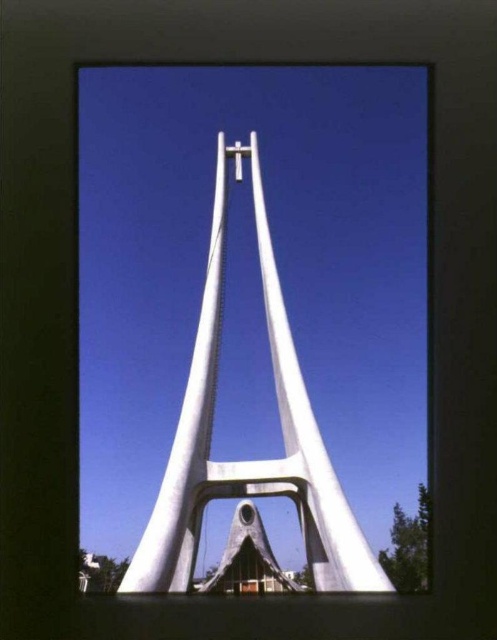
Question: Is white smooth monument at center to the left of white matte cross at center from the viewer's perspective?

Choices:
 (A) no
 (B) yes

Answer: (A)

Question: Does white smooth monument at center have a lesser width compared to white matte cross at center?

Choices:
 (A) no
 (B) yes

Answer: (A)

Question: Can you confirm if white smooth monument at center is positioned above white matte cross at center?

Choices:
 (A) no
 (B) yes

Answer: (A)

Question: Which object appears farthest from the camera in this image?

Choices:
 (A) white smooth monument at center
 (B) white matte cross at center

Answer: (B)

Question: Which point is closer to the camera taking this photo?

Choices:
 (A) (241, 166)
 (B) (269, 346)

Answer: (B)